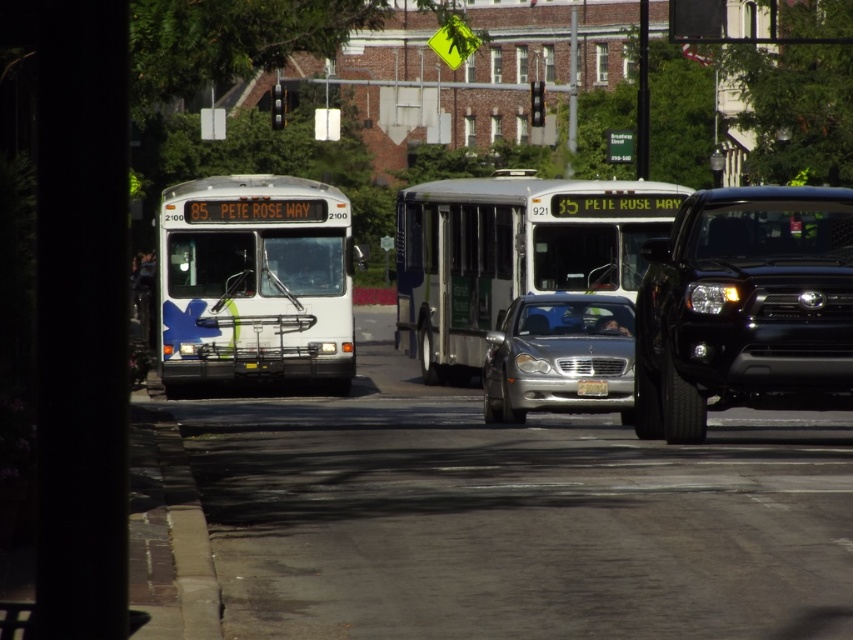
You are a pedestrian standing at the point labeled as point (x=744, y=308) in the image, which is the black matte truck at right. You want to cross the street to reach the white bus with blue and green accents on the left. Is there any vehicle between you and the bus?

The point labeled as point (x=744, y=308) is the black matte truck at right. The white bus with blue and green accents on the left is located to the left of the black matte truck at right. There are several cars mentioned in the scene, but their exact positions aren not specified. However, the silver sedan in the foreground is driving towards the camera and partially obscured, which might be between the truck and the bus. Therefore, there could be vehicles between you and the bus.

You are a pedestrian standing at the crosswalk and see the white matte bus at center and the white metallic bus at center. Which bus is closer to your left side?

The white matte bus at center is to the left of the white metallic bus at center, so it is closer to your left side.